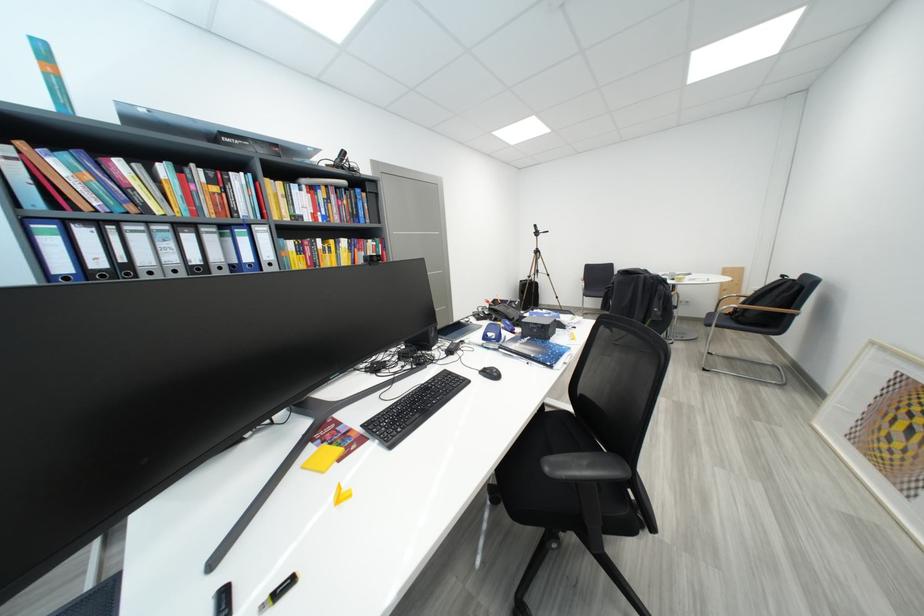
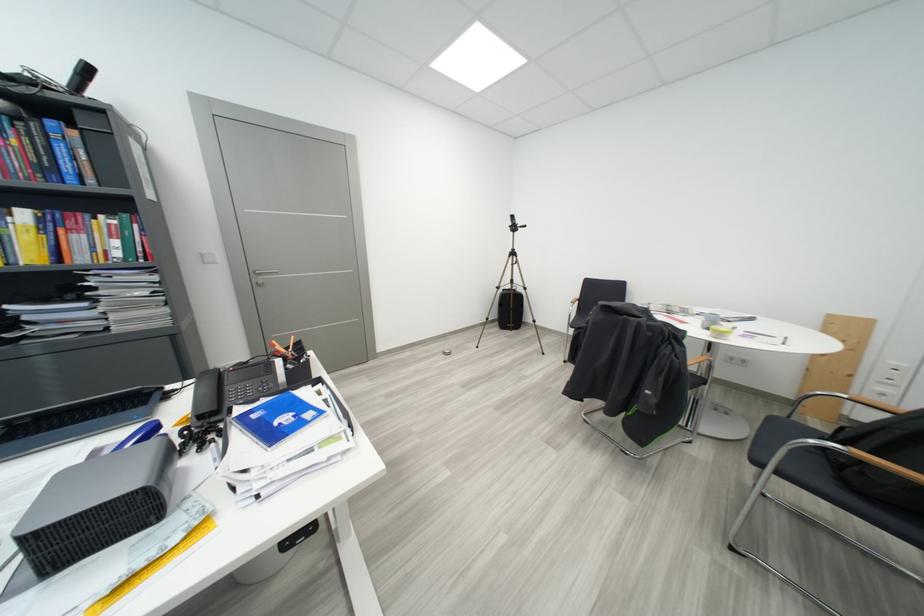
Find the pixel in the second image that matches [718,328] in the first image.

(767, 466)